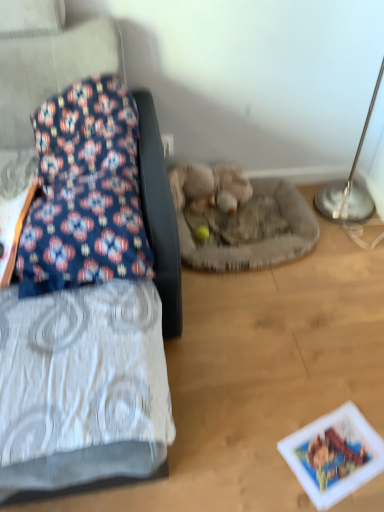
The image size is (384, 512). What are the coordinates of `vacant area that lies between silver metallic table lamp at upper right and printed paper postcard at lower right` in the screenshot? It's located at (336, 311).